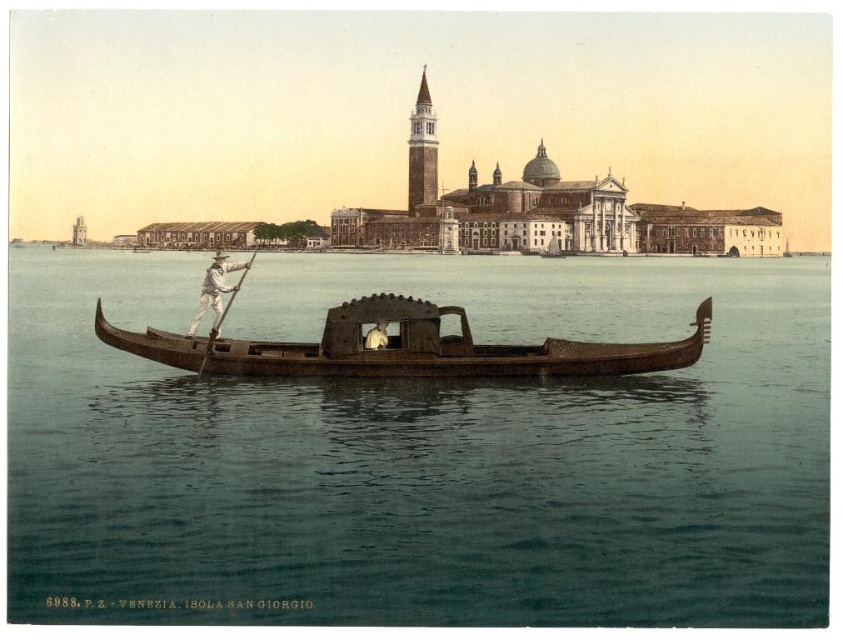
Is point (729, 410) in front of point (414, 140)?

Yes, point (729, 410) is closer to viewer.

Is point (717, 529) closer to camera compared to point (409, 168)?

That is True.

Where is `clear water at center`? clear water at center is located at coordinates [422, 452].

Which is more to the left, clear water at center or wooden canoe at center?

wooden canoe at center is more to the left.

Can you confirm if clear water at center is bigger than wooden canoe at center?

Yes.

Does point (481, 552) lie in front of point (353, 307)?

Yes, it is in front of point (353, 307).

The image size is (843, 640). Identify the location of clear water at center. (422, 452).

Can you confirm if wooden canoe at center is shorter than brown stone bell tower at upper center?

Yes.

Which is below, wooden canoe at center or brown stone bell tower at upper center?

wooden canoe at center is lower down.

Based on the photo, who is more distant from viewer, (275, 372) or (423, 81)?

Positioned behind is point (423, 81).

Identify the location of wooden canoe at center. (404, 348).